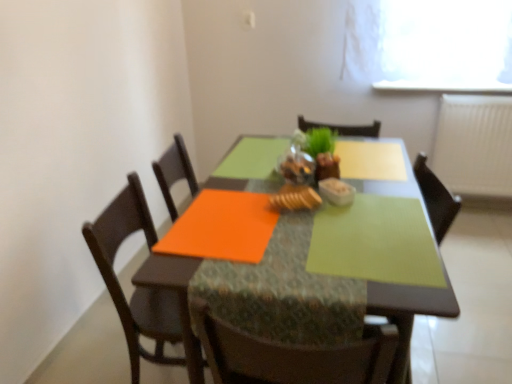
Where is `free area in between green matte placemat at center and baked golden bread at center`? free area in between green matte placemat at center and baked golden bread at center is located at coordinates (297, 236).